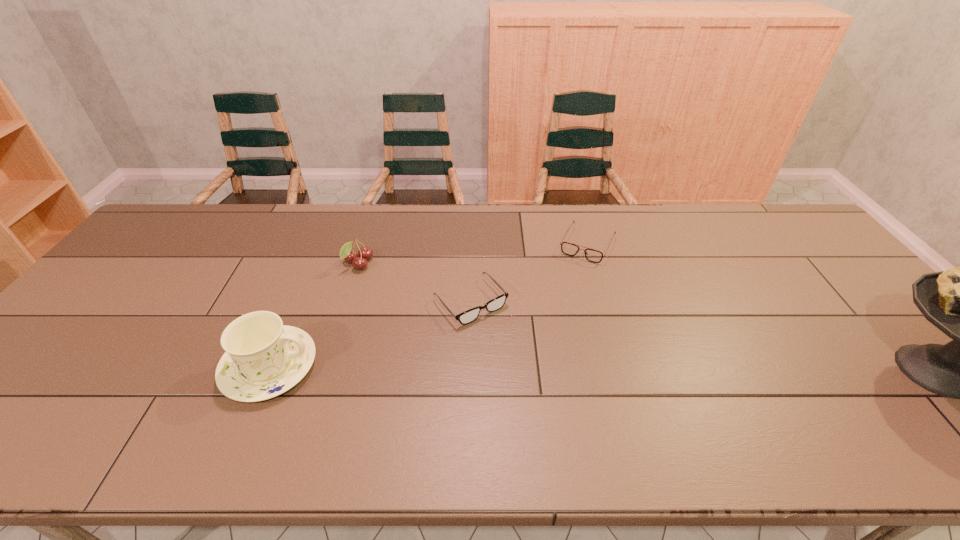
Where is `chinaware`? chinaware is located at coordinates tap(264, 358).

Identify the location of cherry. (365, 253).

Where is `the third object from left to right`? This screenshot has height=540, width=960. the third object from left to right is located at coordinates (495, 304).

The width and height of the screenshot is (960, 540). What are the coordinates of `sunglasses` in the screenshot? It's located at (595, 256).

This screenshot has width=960, height=540. What are the coordinates of `free location located on the handle side of the chinaware` in the screenshot? It's located at (416, 367).

Where is `blank area located 0.340m on the leaves of the cherry`? The image size is (960, 540). blank area located 0.340m on the leaves of the cherry is located at coordinates (453, 322).

The width and height of the screenshot is (960, 540). I want to click on vacant space located 0.350m on the leaves of the cherry, so [456, 324].

Find the location of `vacant space located on the leaves of the cherry`. vacant space located on the leaves of the cherry is located at coordinates (456, 324).

This screenshot has height=540, width=960. What are the coordinates of `free space located 0.310m on the front-facing side of the spectacles` in the screenshot? It's located at (569, 413).

The height and width of the screenshot is (540, 960). What are the coordinates of `free space located 0.180m on the front-facing side of the spectacles` in the screenshot? It's located at (533, 372).